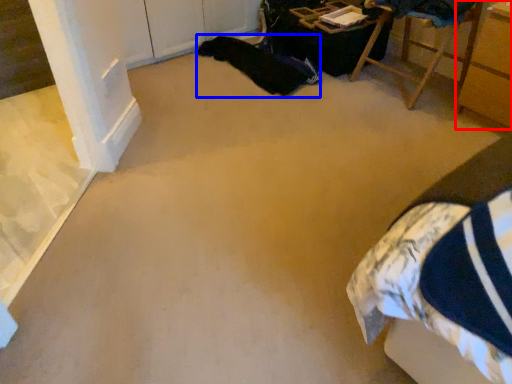
Question: Which object is closer to the camera taking this photo, furniture (highlighted by a red box) or blanket (highlighted by a blue box)?

Choices:
 (A) furniture
 (B) blanket

Answer: (A)